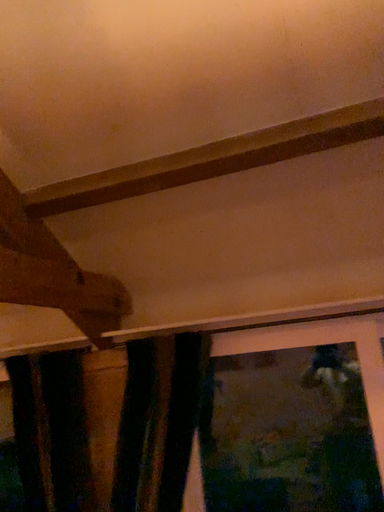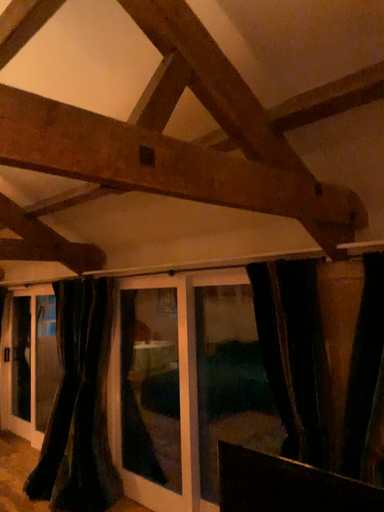
Question: Which way did the camera rotate in the video?

Choices:
 (A) rotated upward
 (B) rotated downward

Answer: (B)